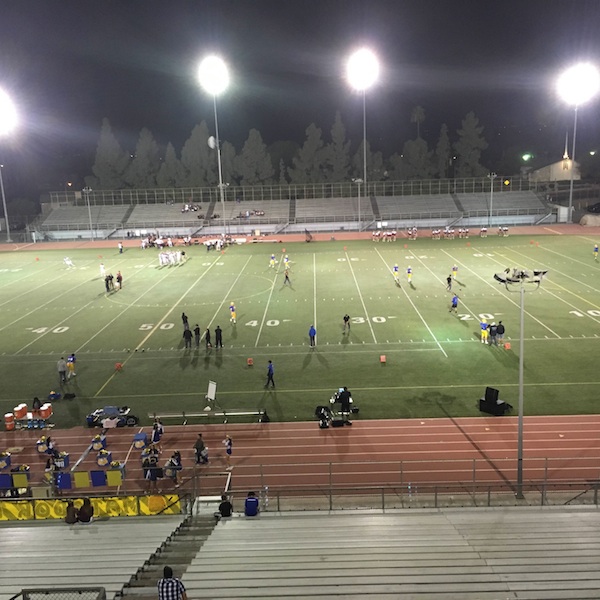
In order to click on speaker in this screenshot , I will do `click(486, 407)`.